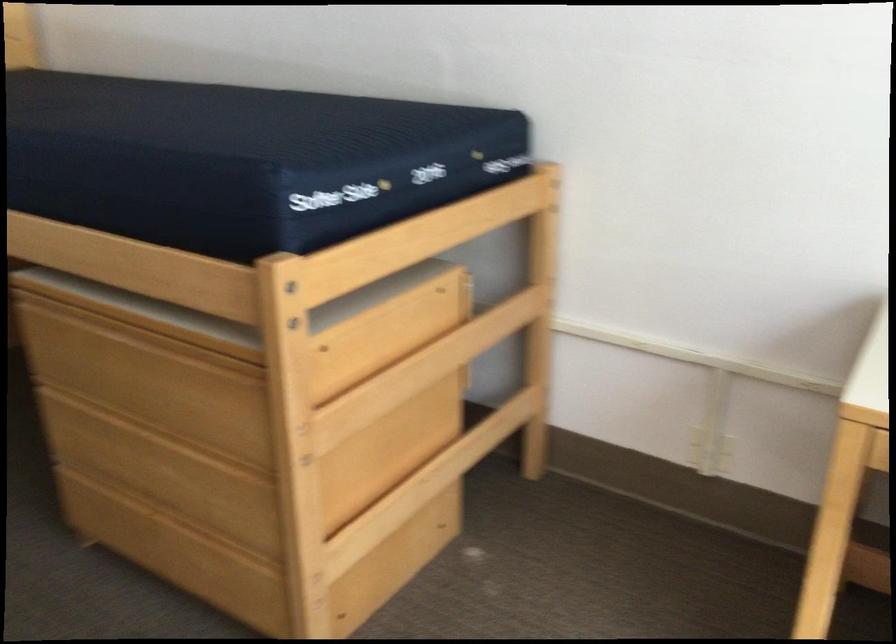
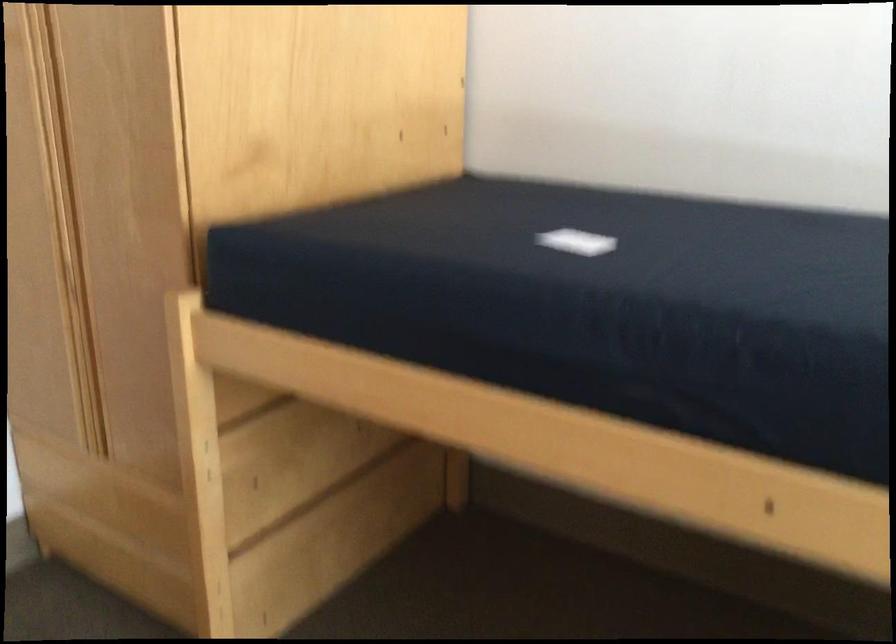
What movement of the cameraman would produce the second image?

The cameraman walked toward left, forward.